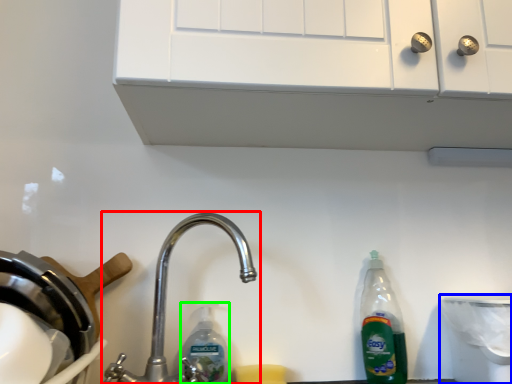
Question: Which object is positioned closest to tap (highlighted by a red box)? Select from appliance (highlighted by a blue box) and cleaning product (highlighted by a green box).

Choices:
 (A) appliance
 (B) cleaning product

Answer: (B)